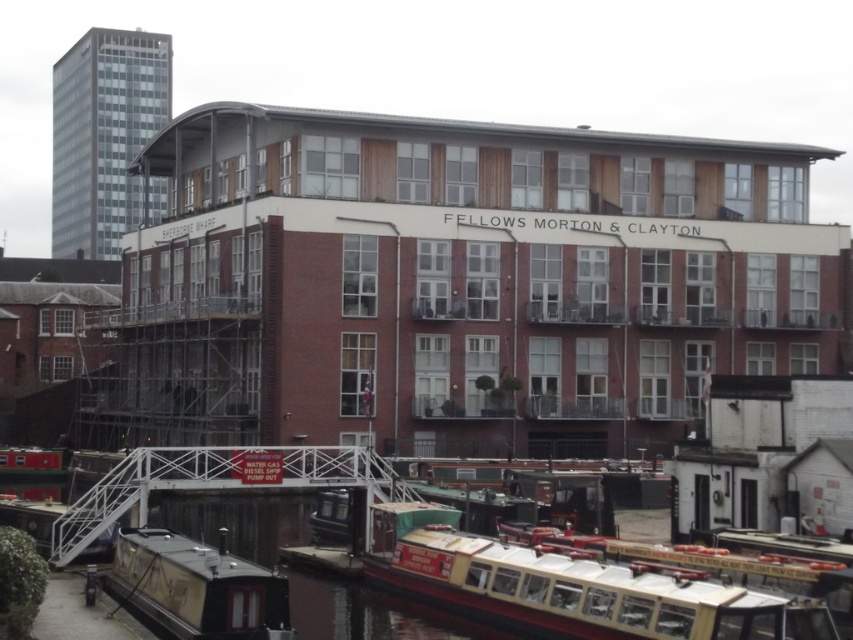
Question: Is white wooden boat at lower center to the left of wooden polished boat at lower left from the viewer's perspective?

Choices:
 (A) no
 (B) yes

Answer: (A)

Question: Does white wooden boat at lower center have a greater width compared to wooden polished boat at lower left?

Choices:
 (A) no
 (B) yes

Answer: (B)

Question: Is white wooden boat at lower center above wooden polished boat at lower left?

Choices:
 (A) yes
 (B) no

Answer: (A)

Question: Which point is farther to the camera?

Choices:
 (A) (469, 616)
 (B) (160, 605)

Answer: (A)

Question: Which point is farther to the camera?

Choices:
 (A) (418, 573)
 (B) (165, 596)

Answer: (A)

Question: Which point is closer to the camera?

Choices:
 (A) wooden polished boat at lower left
 (B) white wooden boat at lower center

Answer: (B)